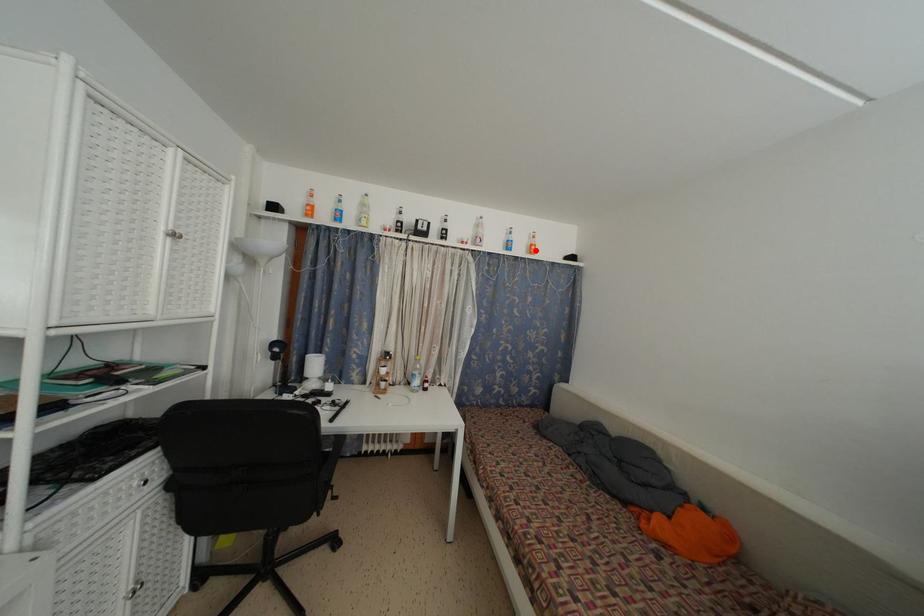
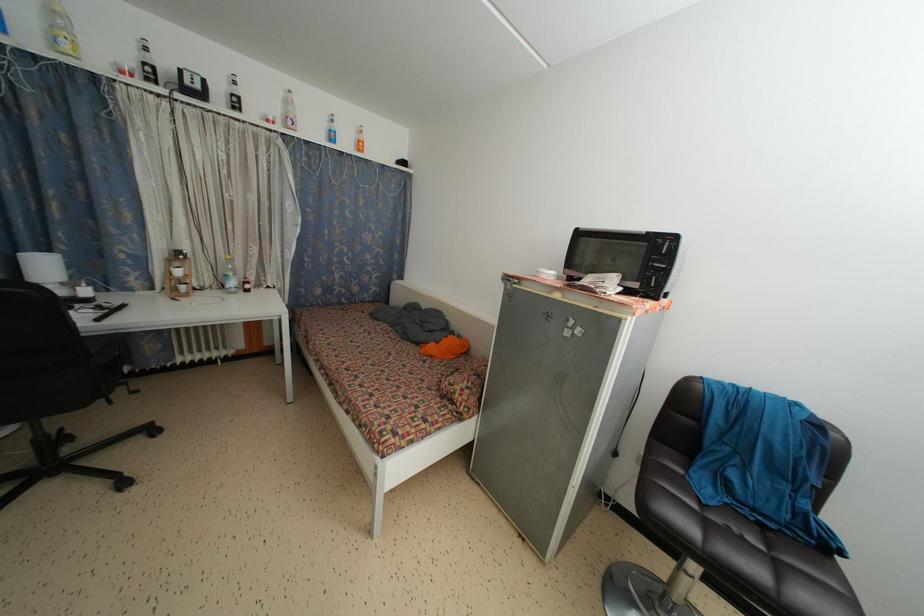
Where in the second image is the point corresponding to the highlighted location from the first image?

(362, 147)